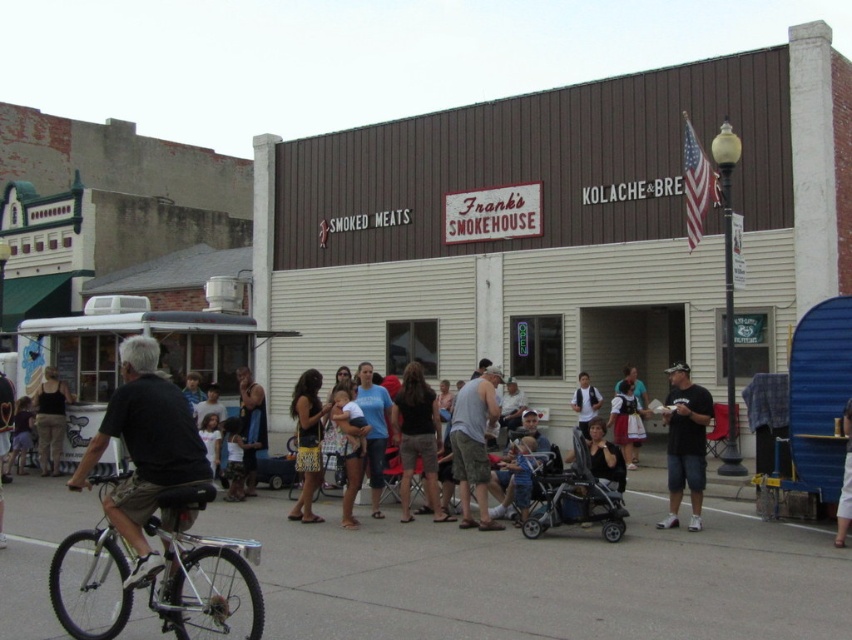
In the scene shown: You are a photographer positioned at the scene described. You need to capture a photo that includes both the light brown leather jacket at lower left and the denim pants at center. Based on their positions, which object should you frame first to ensure both are in the shot?

The light brown leather jacket at lower left is to the left of denim pants at center, so you should frame the light brown leather jacket at lower left first to ensure both are included in the shot.

You are a photographer trying to capture a group photo of the black cotton shirt at lower right and the matte black tank top at lower left. Which one should you place on the right side of the frame to match their current positions?

The black cotton shirt at lower right should be placed on the right side of the frame because it is already positioned on the right side of the matte black tank top at lower left.

You are a delivery person trying to reach the entrance of Frank Smokehouse. You see the silver metallic bicycle at lower left and the dark blue jeans at center. Which object is closer to the entrance?

The silver metallic bicycle at lower left is positioned under dark blue jeans at center, so the bicycle is closer to the entrance than the jeans.